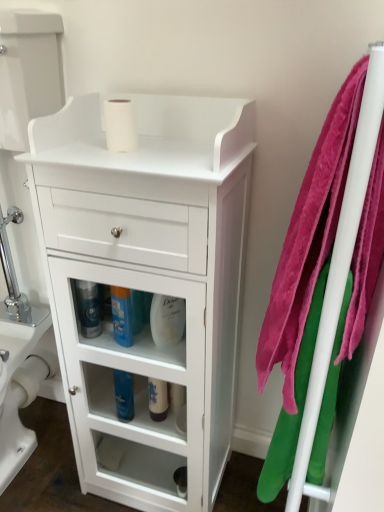
Question: From a real-world perspective, is white glossy bottle at center, the second cleaning product positioned from the right, on blue glossy bottle at center, which is counted as the 3th cleaning product, starting from the right?

Choices:
 (A) no
 (B) yes

Answer: (A)

Question: From the image's perspective, is white glossy bottle at center, the second cleaning product positioned from the right, above blue glossy bottle at center, the 3th cleaning product when ordered from left to right?

Choices:
 (A) yes
 (B) no

Answer: (B)

Question: From the image's perspective, is white glossy bottle at center, which is the 4th cleaning product from left to right, beneath blue glossy bottle at center, the 3th cleaning product when ordered from left to right?

Choices:
 (A) yes
 (B) no

Answer: (A)

Question: Does white glossy bottle at center, which is the 4th cleaning product from left to right, have a greater width compared to blue glossy bottle at center, the 3th cleaning product when ordered from left to right?

Choices:
 (A) no
 (B) yes

Answer: (A)

Question: Does white glossy bottle at center, which is the 4th cleaning product from left to right, have a lesser height compared to blue glossy bottle at center, the 3th cleaning product when ordered from left to right?

Choices:
 (A) no
 (B) yes

Answer: (B)

Question: Can you confirm if white glossy bottle at center, the second cleaning product positioned from the right, is thinner than blue glossy bottle at center, which is counted as the 3th cleaning product, starting from the right?

Choices:
 (A) yes
 (B) no

Answer: (A)

Question: Can you confirm if blue glossy bottle at center, the 3th cleaning product when ordered from left to right, is smaller than white glossy cabinet at center?

Choices:
 (A) yes
 (B) no

Answer: (A)

Question: Can white glossy cabinet at center be found inside blue glossy bottle at center, which is counted as the 3th cleaning product, starting from the right?

Choices:
 (A) no
 (B) yes

Answer: (A)

Question: From the image's perspective, is blue glossy bottle at center, which is counted as the 3th cleaning product, starting from the right, beneath white glossy cabinet at center?

Choices:
 (A) yes
 (B) no

Answer: (B)

Question: Is blue glossy bottle at center, the 3th cleaning product when ordered from left to right, outside of white glossy cabinet at center?

Choices:
 (A) no
 (B) yes

Answer: (A)

Question: From a real-world perspective, is blue glossy bottle at center, the 3th cleaning product when ordered from left to right, below white glossy cabinet at center?

Choices:
 (A) no
 (B) yes

Answer: (A)

Question: Is blue glossy bottle at center, the 3th cleaning product when ordered from left to right, oriented away from white glossy cabinet at center?

Choices:
 (A) yes
 (B) no

Answer: (A)

Question: Does pink plush towel at right, the first bath towel viewed from the right, have a lesser width compared to white matte toilet paper at lower center, acting as the second toilet paper starting from the right?

Choices:
 (A) no
 (B) yes

Answer: (A)